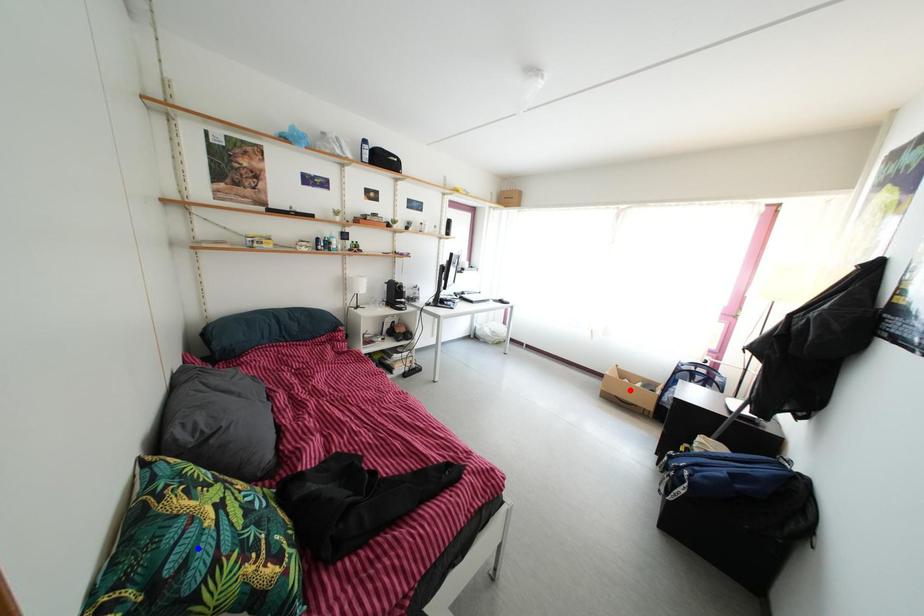
Question: Which of the two points in the image is closer to the camera?

Choices:
 (A) Blue point is closer.
 (B) Red point is closer.

Answer: (A)